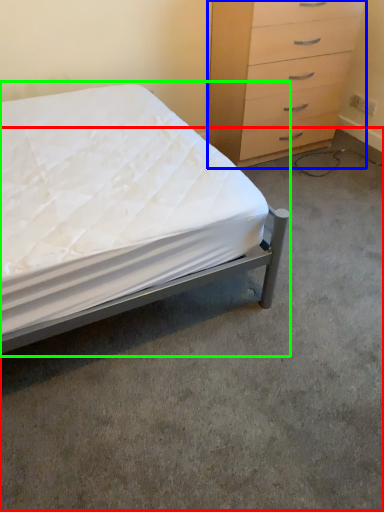
Question: Estimate the real-world distances between objects in this image. Which object is farther from concrete (highlighted by a red box), chest of drawers (highlighted by a blue box) or bed (highlighted by a green box)?

Choices:
 (A) chest of drawers
 (B) bed

Answer: (A)